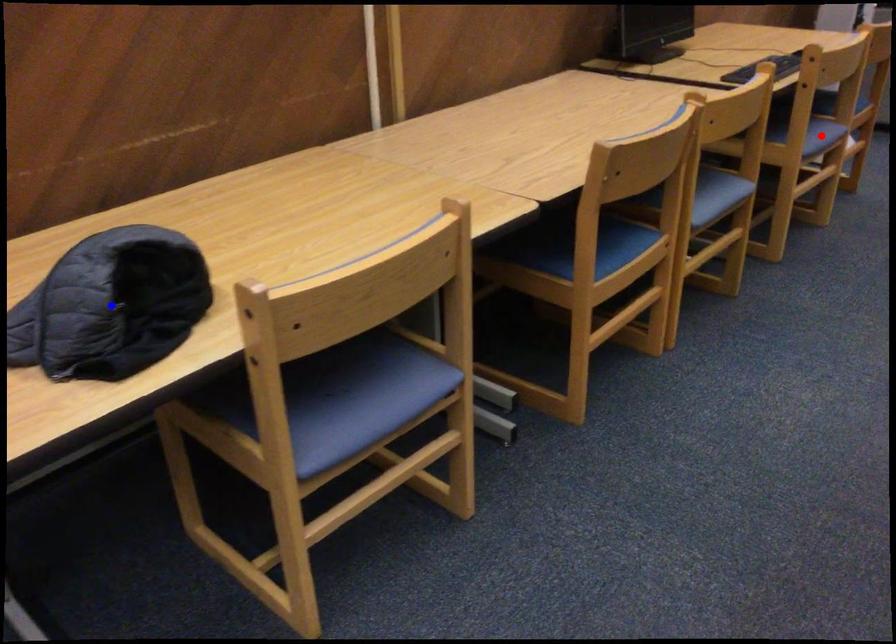
Question: Which of the two points in the image is closer to the camera?

Choices:
 (A) Blue point is closer.
 (B) Red point is closer.

Answer: (A)